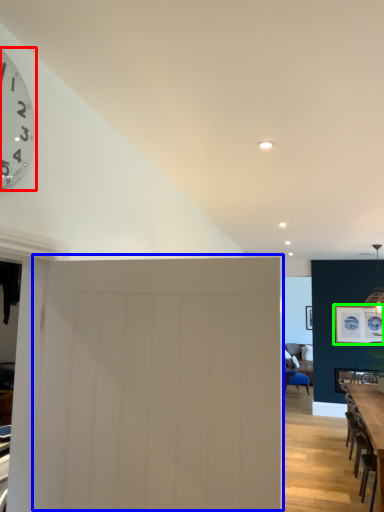
Question: Which object is the closest to the wall clock (highlighted by a red box)? Choose among these: door (highlighted by a blue box) or picture frame (highlighted by a green box).

Choices:
 (A) door
 (B) picture frame

Answer: (A)